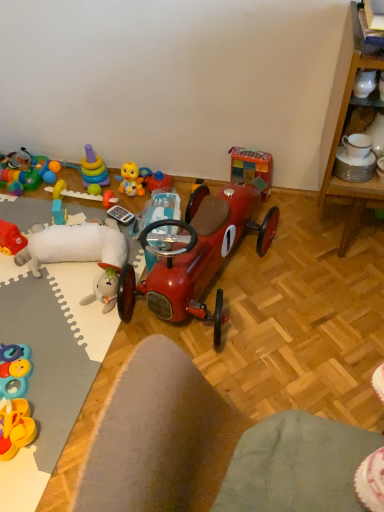
You are a GUI agent. You are given a task and a screenshot of the screen. Output one action in this format:
    pyautogui.click(x=<x>, y=<y>)
    Task: Click on the vacant area in front of wooden block tower at upper right, the first toy in the right-to-left sequence
    The image size is (384, 512).
    Given the screenshot: What is the action you would take?
    click(268, 223)